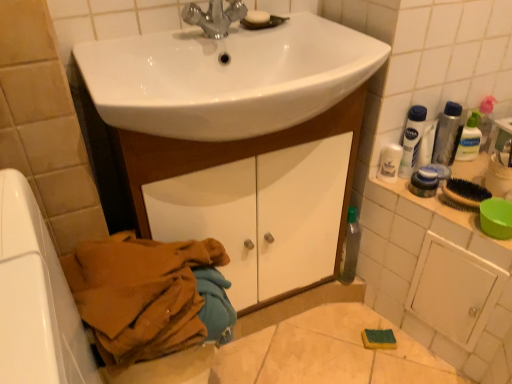
Question: Is brown fabric at lower left bigger or smaller than white glossy cabinet at center?

Choices:
 (A) small
 (B) big

Answer: (A)

Question: Is brown fabric at lower left spatially inside white glossy cabinet at center, or outside of it?

Choices:
 (A) outside
 (B) inside

Answer: (A)

Question: Which object is the closest to the white glossy sink at center?

Choices:
 (A) white glossy cabinet at right
 (B) white glossy mouthwash at upper right, which is counted as the second mouthwash, starting from the right
 (C) silver metallic mouthwash at upper right, positioned as the first mouthwash in right-to-left order
 (D) silver metallic faucet at upper center
 (E) clear plastic bottle at upper right, the 1th toiletry when ordered from right to left

Answer: (D)

Question: Which object is positioned farthest from the silver metallic mouthwash at upper right, positioned as the first mouthwash in right-to-left order?

Choices:
 (A) white glossy sink at center
 (B) silver metallic faucet at upper center
 (C) white plastic bottle at upper right
 (D) white plastic container at upper right, positioned as the 2th toiletry in top-to-bottom order
 (E) white glossy cabinet at center

Answer: (B)